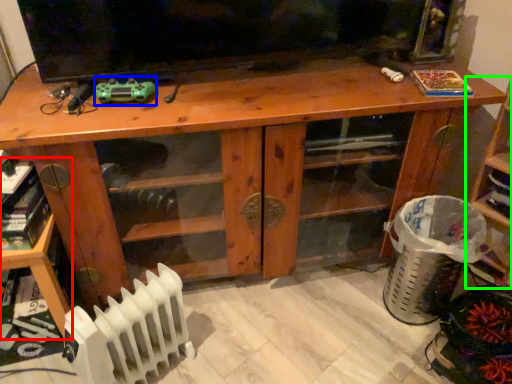
Question: Which is nearer to the shelf (highlighted by a red box)? toy (highlighted by a blue box) or shelf (highlighted by a green box).

Choices:
 (A) toy
 (B) shelf

Answer: (A)